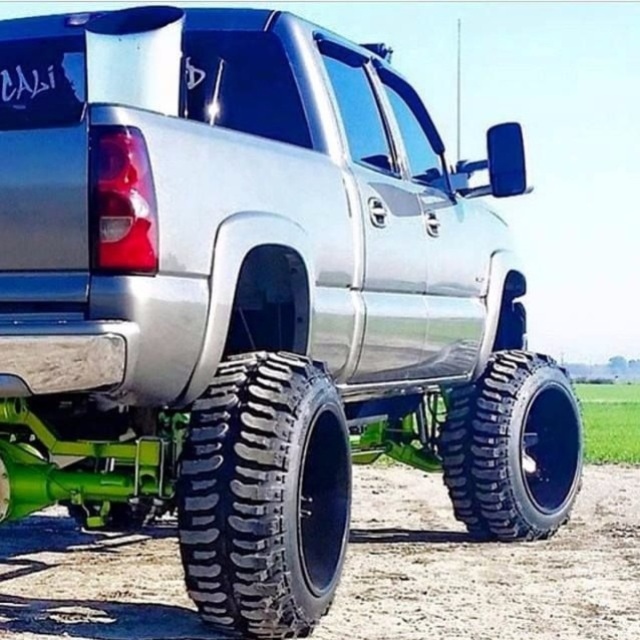
Image resolution: width=640 pixels, height=640 pixels. Describe the element at coordinates (484, 566) in the screenshot. I see `dirtloose/granular at lower center` at that location.

Who is more forward, (x=532, y=618) or (x=307, y=388)?

Point (x=307, y=388) is in front.

Where is `dirtloose/granular at lower center`? This screenshot has height=640, width=640. dirtloose/granular at lower center is located at coordinates (484, 566).

Does black rubber tire at lower left appear over black rubber tire at lower right?

Yes.

What do you see at coordinates (264, 496) in the screenshot? Image resolution: width=640 pixels, height=640 pixels. I see `black rubber tire at lower left` at bounding box center [264, 496].

You are a GUI agent. You are given a task and a screenshot of the screen. Output one action in this format:
    pyautogui.click(x=<x>, y=<y>)
    Task: Click on the black rubber tire at lower left
    Image resolution: width=640 pixels, height=640 pixels.
    Given the screenshot: What is the action you would take?
    pyautogui.click(x=264, y=496)

Is the position of dirtloose/granular at lower center less distant than that of black rubber tire at lower right?

Yes, dirtloose/granular at lower center is closer to the viewer.

Looking at this image, who is shorter, dirtloose/granular at lower center or black rubber tire at lower right?

With less height is dirtloose/granular at lower center.

Describe the element at coordinates (484, 566) in the screenshot. I see `dirtloose/granular at lower center` at that location.

Where is `dirtloose/granular at lower center`? Image resolution: width=640 pixels, height=640 pixels. dirtloose/granular at lower center is located at coordinates (484, 566).